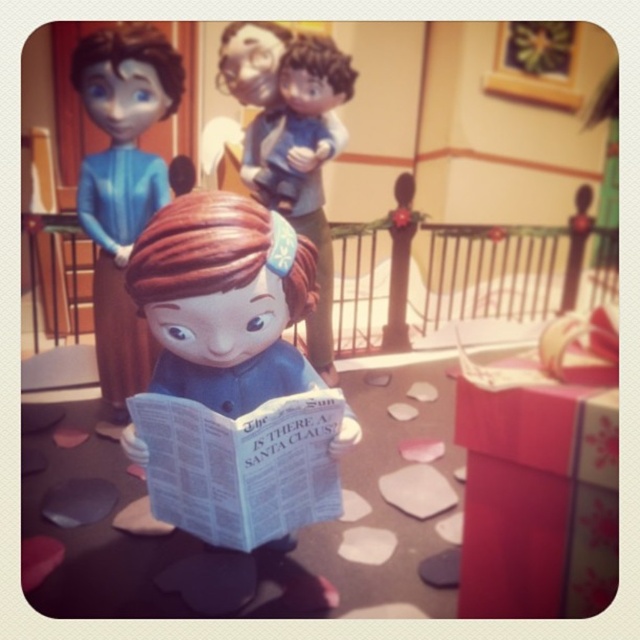
Question: Where is matte plastic figurine at center located in relation to smooth plastic figurine at upper center in the image?

Choices:
 (A) below
 (B) above

Answer: (A)

Question: Is matte plastic figurine at center thinner than white paper book at center?

Choices:
 (A) yes
 (B) no

Answer: (B)

Question: Which of the following is the closest to the observer?

Choices:
 (A) (230, 461)
 (B) (296, 300)
 (C) (305, 42)
 (D) (136, 316)

Answer: (A)

Question: Which point appears farthest from the camera in this image?

Choices:
 (A) (296, 65)
 (B) (92, 96)
 (C) (266, 499)

Answer: (A)

Question: Which of the following is the farthest from the observer?

Choices:
 (A) matte blue doll at center
 (B) white paper book at center

Answer: (A)

Question: Is matte plastic figurine at center to the right of white paper book at center from the viewer's perspective?

Choices:
 (A) no
 (B) yes

Answer: (A)